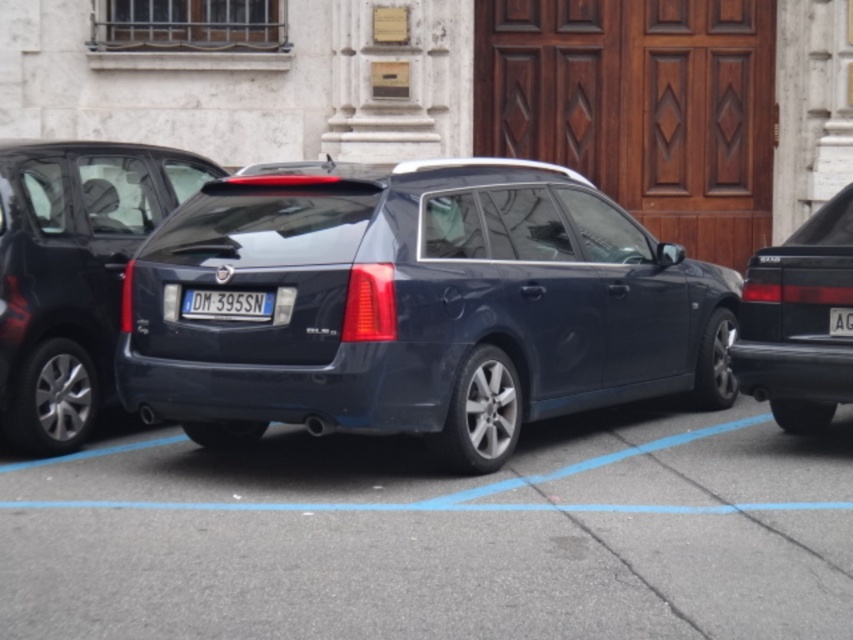
Who is more distant from viewer, (828, 250) or (845, 326)?

The point (828, 250) is more distant.

Can you confirm if black glossy sedan at right is positioned above white plastic license plate at center?

No.

Where is `black glossy sedan at right`? Image resolution: width=853 pixels, height=640 pixels. black glossy sedan at right is located at coordinates (798, 321).

The image size is (853, 640). Identify the location of black glossy sedan at right. (798, 321).

Can you confirm if black glossy sedan at right is positioned to the left of blue plastic license plate at center?

Incorrect, black glossy sedan at right is not on the left side of blue plastic license plate at center.

Is black glossy sedan at right above blue plastic license plate at center?

No, black glossy sedan at right is not above blue plastic license plate at center.

Who is more forward, (782, 376) or (196, 310)?

Point (196, 310)

Locate an element on the screen. black glossy sedan at right is located at coordinates (798, 321).

Who is more distant from viewer, (369, 449) or (228, 292)?

The point (369, 449) is behind.

Which of these two, dark blue car at center or blue plastic license plate at center, stands shorter?

dark blue car at center

Identify the location of dark blue car at center. (444, 536).